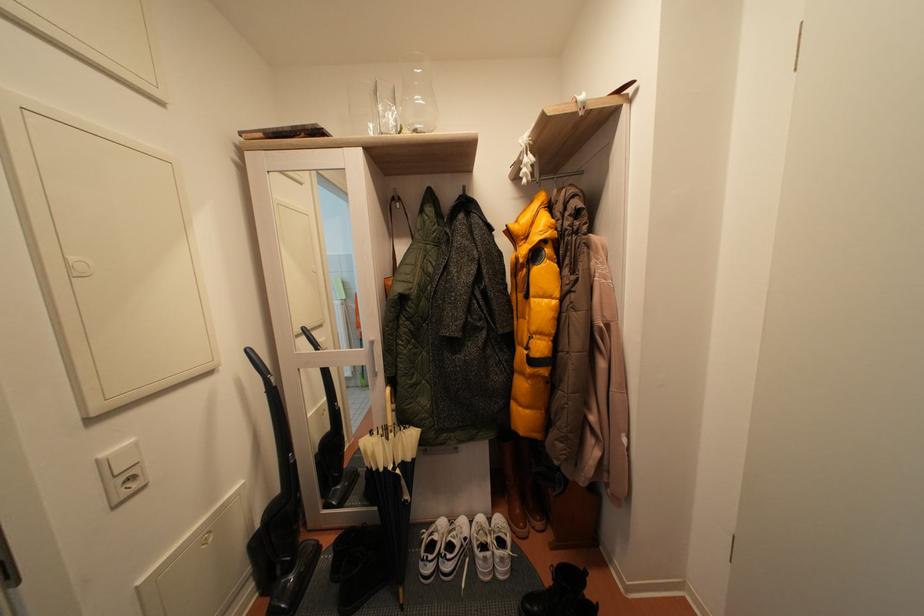
Find where to lift the clear drinking glass. Please return your answer as a coordinate pair (x, y).

(417, 94)